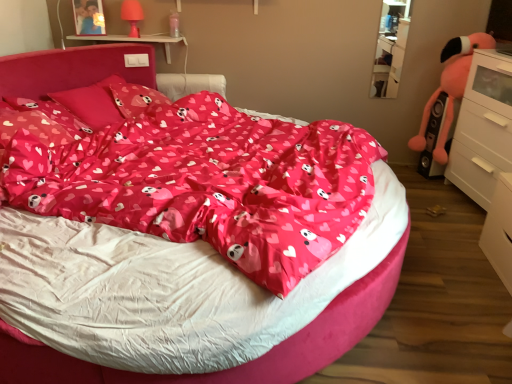
Question: Considering the relative positions of clear glass shelf at upper right and matte pink pillow at upper left, the third pillow when ordered from back to front, in the image provided, is clear glass shelf at upper right to the left of matte pink pillow at upper left, the third pillow when ordered from back to front, from the viewer's perspective?

Choices:
 (A) no
 (B) yes

Answer: (A)

Question: From the image's perspective, is clear glass shelf at upper right located above matte pink pillow at upper left, arranged as the 1th pillow when viewed from the front?

Choices:
 (A) yes
 (B) no

Answer: (A)

Question: Does clear glass shelf at upper right lie in front of matte pink pillow at upper left, the third pillow when ordered from back to front?

Choices:
 (A) yes
 (B) no

Answer: (B)

Question: Is clear glass shelf at upper right far from matte pink pillow at upper left, arranged as the 1th pillow when viewed from the front?

Choices:
 (A) yes
 (B) no

Answer: (A)

Question: Is clear glass shelf at upper right outside matte pink pillow at upper left, the third pillow when ordered from back to front?

Choices:
 (A) no
 (B) yes

Answer: (B)

Question: Considering the relative sizes of clear glass shelf at upper right and matte pink pillow at upper left, arranged as the 1th pillow when viewed from the front, in the image provided, is clear glass shelf at upper right shorter than matte pink pillow at upper left, arranged as the 1th pillow when viewed from the front,?

Choices:
 (A) no
 (B) yes

Answer: (A)

Question: From the image's perspective, is fluffy pink stuffed animal at right above matte pink pillow at center, arranged as the 2th pillow when viewed from the back?

Choices:
 (A) yes
 (B) no

Answer: (A)

Question: Can you confirm if fluffy pink stuffed animal at right is taller than matte pink pillow at center, the second pillow from the front?

Choices:
 (A) no
 (B) yes

Answer: (B)

Question: Considering the relative sizes of fluffy pink stuffed animal at right and matte pink pillow at center, arranged as the 2th pillow when viewed from the back, in the image provided, is fluffy pink stuffed animal at right thinner than matte pink pillow at center, arranged as the 2th pillow when viewed from the back,?

Choices:
 (A) yes
 (B) no

Answer: (A)

Question: From the image's perspective, does fluffy pink stuffed animal at right appear lower than matte pink pillow at center, arranged as the 2th pillow when viewed from the back?

Choices:
 (A) yes
 (B) no

Answer: (B)

Question: Is the depth of fluffy pink stuffed animal at right less than that of matte pink pillow at center, arranged as the 2th pillow when viewed from the back?

Choices:
 (A) yes
 (B) no

Answer: (B)

Question: Can you confirm if fluffy pink stuffed animal at right is shorter than matte pink pillow at center, the second pillow from the front?

Choices:
 (A) yes
 (B) no

Answer: (B)

Question: Is white glossy chest of drawers at right aimed at fluffy pink stuffed animal at right?

Choices:
 (A) yes
 (B) no

Answer: (B)